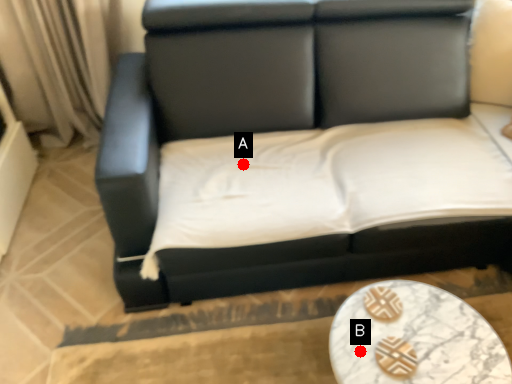
Question: Two points are circled on the image, labeled by A and B beside each circle. Which point is closer to the camera taking this photo?

Choices:
 (A) A is closer
 (B) B is closer

Answer: (B)